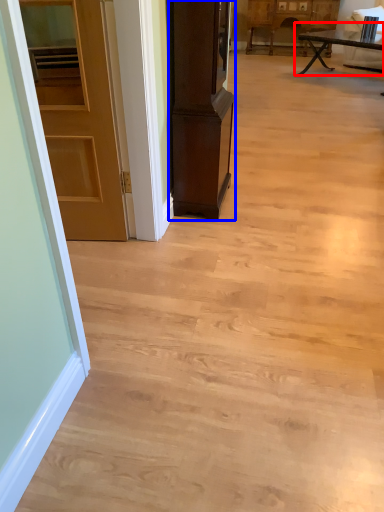
Question: Which of the following is the farthest to the observer, table (highlighted by a red box) or cabinetry (highlighted by a blue box)?

Choices:
 (A) table
 (B) cabinetry

Answer: (A)